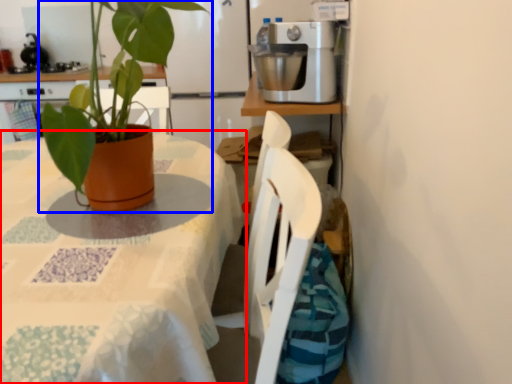
Question: Which object appears farthest to the camera in this image, table (highlighted by a red box) or houseplant (highlighted by a blue box)?

Choices:
 (A) table
 (B) houseplant

Answer: (B)